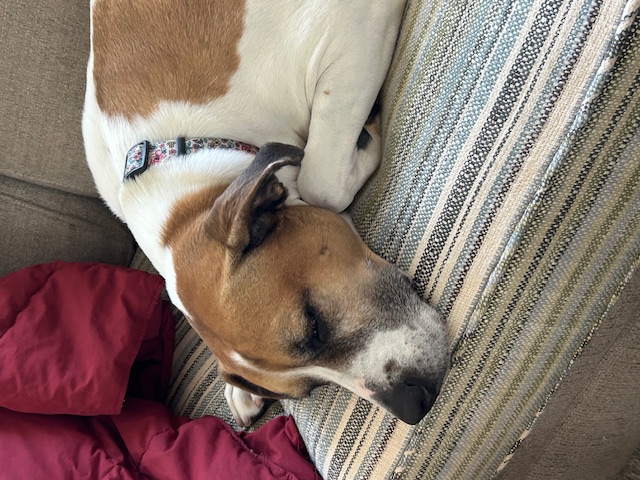
Where is `couch`? The height and width of the screenshot is (480, 640). couch is located at coordinates (363, 363).